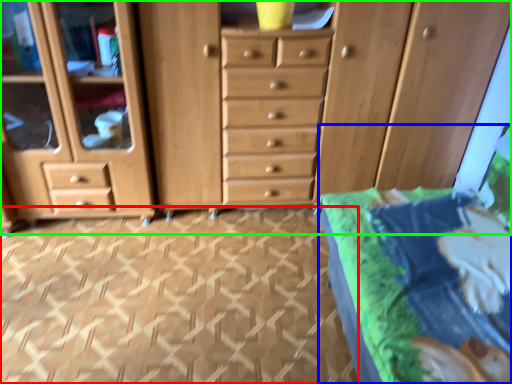
Question: Considering the real-world distances, which object is farthest from tile (highlighted by a red box)? bed (highlighted by a blue box) or chest of drawers (highlighted by a green box)?

Choices:
 (A) bed
 (B) chest of drawers

Answer: (A)